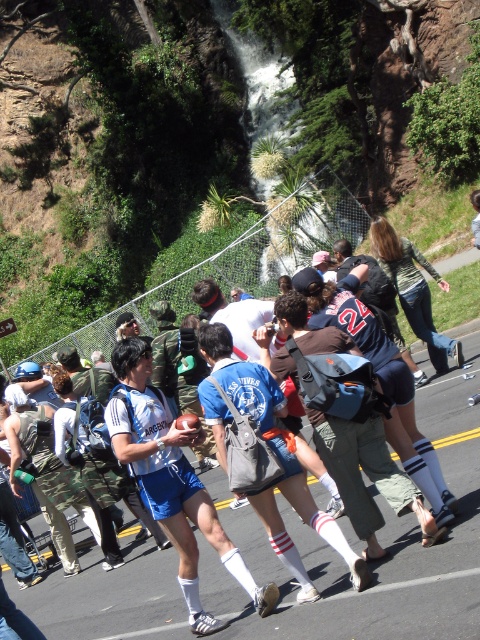
You are a photographer standing on the road near the waterfall and want to take a photo that includes both the white fabric shorts at center and the dark blue jersey at center. Which object will appear larger in your photo?

The white fabric shorts at center will appear larger in the photo because it is closer to the viewer than the dark blue jersey at center.

You are a photographer trying to capture a clear shot of both the white fabric shorts at center and the dark blue jersey at center. Since they are both at the center, you need to adjust your camera angle to ensure both are in focus. Which object should you focus on first to ensure the other is also in focus, considering their sizes?

The white fabric shorts at center has a greater height compared to the dark blue jersey at center. Therefore, focusing on the white fabric shorts at center first would ensure the dark blue jersey at center is also in focus due to its smaller size being within the depth of field.